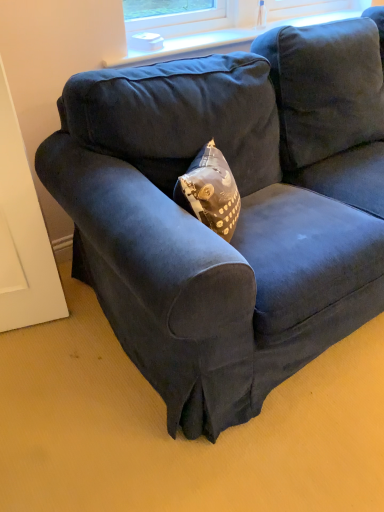
The image size is (384, 512). In order to click on clear glass window at upper center in this screenshot , I will do `click(227, 27)`.

The width and height of the screenshot is (384, 512). What do you see at coordinates (227, 27) in the screenshot?
I see `clear glass window at upper center` at bounding box center [227, 27].

At what (x,y) coordinates should I click in order to perform the action: click on clear glass window at upper center. Please return your answer as a coordinate pair (x, y). The image size is (384, 512). Looking at the image, I should click on (227, 27).